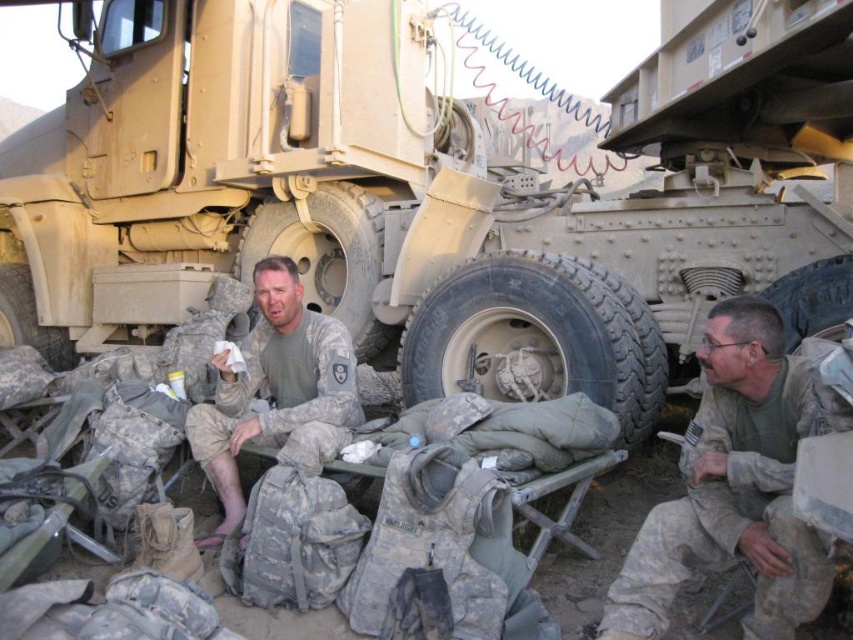
Question: Estimate the real-world distances between objects in this image. Which object is closer to the camouflage fabric tire at center?

Choices:
 (A) camouflage fabric uniform at center
 (B) camouflage rubber tire at lower left
 (C) black rubber tire at center
 (D) rubber/textured tire at center

Answer: (C)

Question: Which point is closer to the camera taking this photo?

Choices:
 (A) (791, 339)
 (B) (751, 112)
 (C) (708, 356)

Answer: (C)

Question: Which is nearer to the camouflage fabric uniform at center?

Choices:
 (A) camouflage fabric tire at center
 (B) matte tan truck at center
 (C) rubber/textured tire at center

Answer: (A)

Question: Can you confirm if camouflage uniform at lower right is positioned above rubber/textured tire at center?

Choices:
 (A) yes
 (B) no

Answer: (B)

Question: Is camouflage uniform at lower right above rubber/textured tire at center?

Choices:
 (A) yes
 (B) no

Answer: (B)

Question: From the image, what is the correct spatial relationship of rubber/textured tire at center in relation to camouflage rubber tire at lower left?

Choices:
 (A) above
 (B) below

Answer: (A)